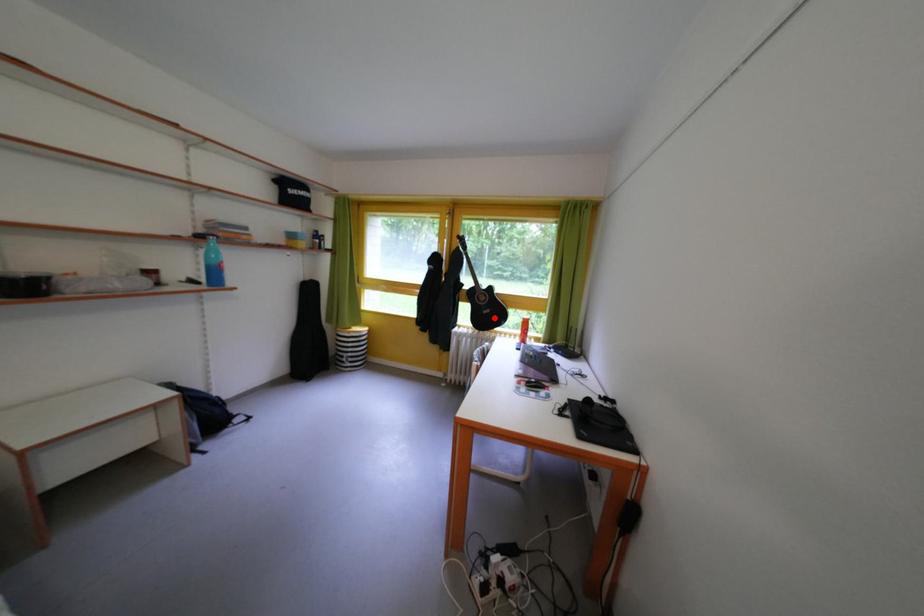
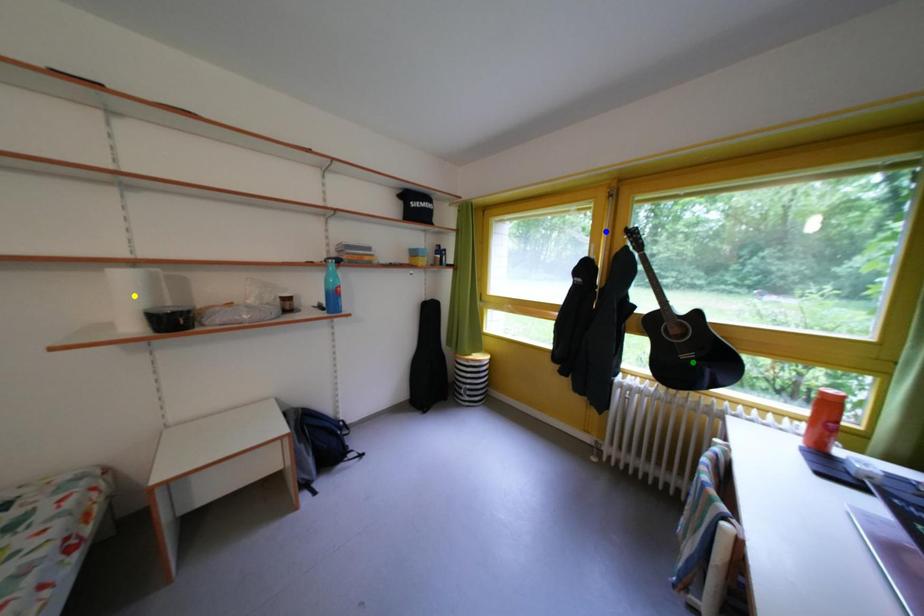
Question: I am providing you with two images of the same scene from different viewpoints. A red point is marked on the first image. You are given multiple points on the second image. Can you choose the point in image 2 that corresponds to the point in image 1?

Choices:
 (A) blue point
 (B) green point
 (C) yellow point

Answer: (B)